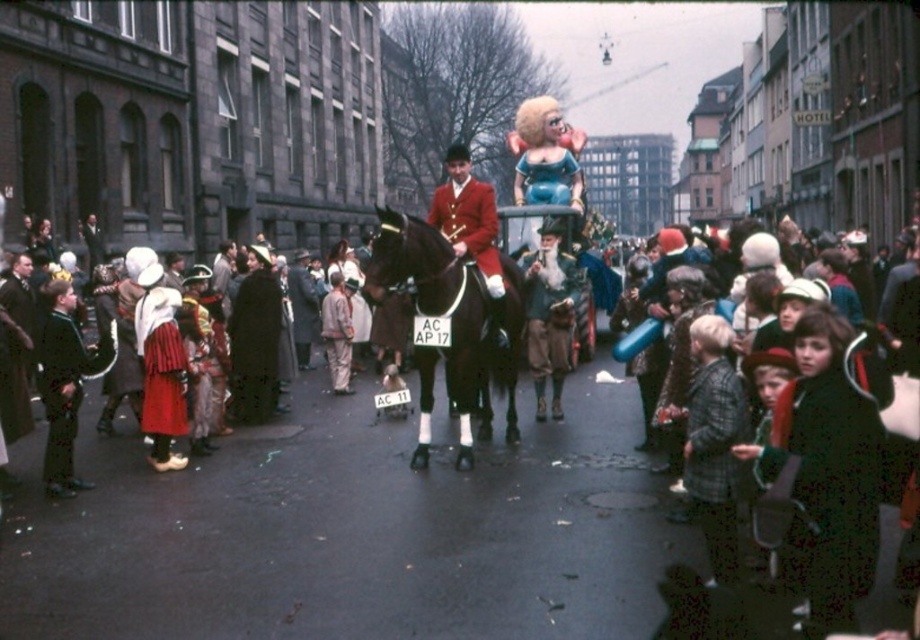
You are a photographer trying to capture both the red woolen coat at left and the red velvet santa claus at center in a single frame. Which object should you focus on first to ensure both are in the frame?

Since the red woolen coat at left is bigger than the red velvet santa claus at center, you should focus on the red woolen coat at left first to ensure both fit within the frame.

You are standing at the center of the street and want to locate the plaid wool jacket at lower right. According to the coordinates provided, in which direction should you move to find it?

The plaid wool jacket at lower right is located at coordinates point (713,442), so you should move towards the lower right direction from the center to find it.